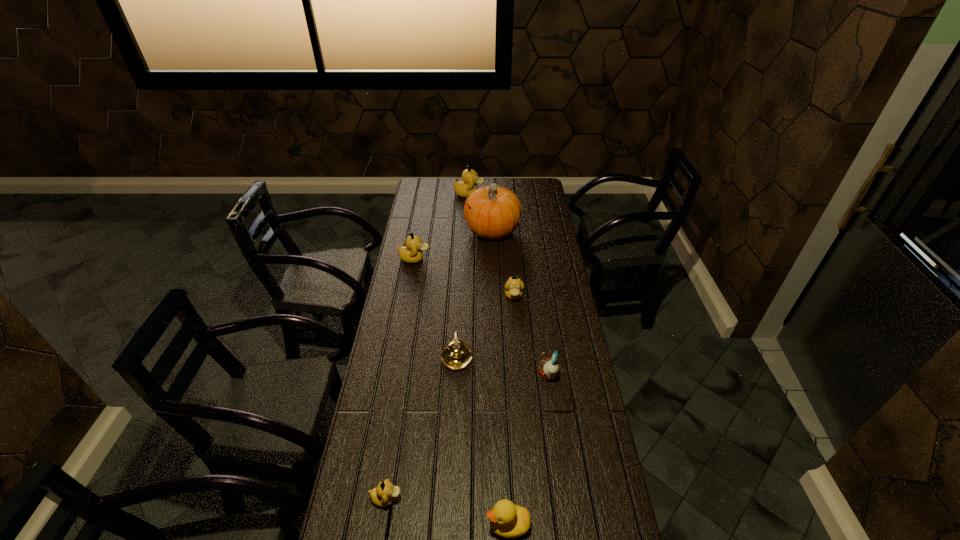
Image resolution: width=960 pixels, height=540 pixels. In the image, there is a desktop. In order to click on vacant space at the right edge in this screenshot , I will do `click(549, 273)`.

In the image, there is a desktop. Identify the location of vacant space at the far left corner. Image resolution: width=960 pixels, height=540 pixels. (420, 184).

I want to click on free space between the rightmost object and the second biggest tan duckling, so click(482, 317).

Where is `free area in between the fourth farthest object and the second farthest object`? This screenshot has height=540, width=960. free area in between the fourth farthest object and the second farthest object is located at coordinates (503, 264).

The height and width of the screenshot is (540, 960). Find the location of `free space that is in between the rightmost object and the fifth nearest object`. free space that is in between the rightmost object and the fifth nearest object is located at coordinates click(x=531, y=335).

The height and width of the screenshot is (540, 960). I want to click on empty space that is in between the rightmost tan duckling and the rightmost object, so click(x=531, y=335).

Image resolution: width=960 pixels, height=540 pixels. Identify the location of the second closest object to the farthest tan duckling. (411, 253).

Select which object is the closest to the nearest tan duckling. Please provide its 2D coordinates. Your answer should be formatted as a tuple, i.e. [(x, y)], where the tuple contains the x and y coordinates of a point satisfying the conditions above.

[(506, 520)]

Select which duckling appears as the fourth closest to the shortest object. Please provide its 2D coordinates. Your answer should be formatted as a tuple, i.e. [(x, y)], where the tuple contains the x and y coordinates of a point satisfying the conditions above.

[(464, 188)]

Identify which duckling is the nearest to the second farthest tan duckling. Please provide its 2D coordinates. Your answer should be formatted as a tuple, i.e. [(x, y)], where the tuple contains the x and y coordinates of a point satisfying the conditions above.

[(514, 286)]